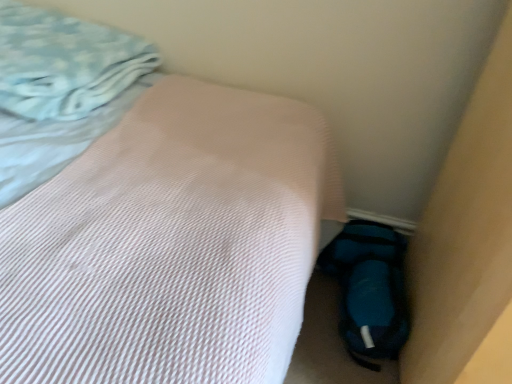
The width and height of the screenshot is (512, 384). I want to click on blue fuzzy sleeping bag at lower right, so click(x=370, y=289).

This screenshot has width=512, height=384. Describe the element at coordinates (370, 289) in the screenshot. I see `blue fuzzy sleeping bag at lower right` at that location.

This screenshot has height=384, width=512. I want to click on pink textured bed at center, so click(148, 213).

Based on the photo, is blue fuzzy sleeping bag at lower right beside pink textured bed at center?

No, blue fuzzy sleeping bag at lower right is not in contact with pink textured bed at center.

From a real-world perspective, between blue fuzzy sleeping bag at lower right and pink textured bed at center, who is vertically higher?

pink textured bed at center, from a real-world perspective.

From the image's perspective, which is above, blue fuzzy sleeping bag at lower right or pink textured bed at center?

pink textured bed at center is shown above in the image.

How much distance is there between blue fuzzy sleeping bag at lower right and pink textured bed at center?

62.62 centimeters.

Between light blue textured blanket at upper left and blue fuzzy sleeping bag at lower right, which one has larger size?

light blue textured blanket at upper left.

Is light blue textured blanket at upper left aimed at blue fuzzy sleeping bag at lower right?

No, light blue textured blanket at upper left is not oriented towards blue fuzzy sleeping bag at lower right.

This screenshot has width=512, height=384. I want to click on blanket in front of the blue fuzzy sleeping bag at lower right, so click(64, 63).

Can blue fuzzy sleeping bag at lower right be found inside light blue textured blanket at upper left?

No.

Is pink textured bed at center oriented away from light blue textured blanket at upper left?

Yes, light blue textured blanket at upper left is at the back of pink textured bed at center.

Find the location of `blanket behind the pink textured bed at center`. blanket behind the pink textured bed at center is located at coordinates (64, 63).

Measure the distance from pink textured bed at center to light blue textured blanket at upper left.

A distance of 20.23 centimeters exists between pink textured bed at center and light blue textured blanket at upper left.

Is point (89, 253) positioned after point (73, 93)?

That is False.

Does blue fuzzy sleeping bag at lower right come in front of light blue textured blanket at upper left?

No.

Based on the photo, from the image's perspective, which one is positioned higher, blue fuzzy sleeping bag at lower right or light blue textured blanket at upper left?

From the image's view, light blue textured blanket at upper left is above.

You are a GUI agent. You are given a task and a screenshot of the screen. Output one action in this format:
    pyautogui.click(x=<x>, y=<y>)
    Task: Click on the blanket in front of the blue fuzzy sleeping bag at lower right
    The height and width of the screenshot is (384, 512).
    Given the screenshot: What is the action you would take?
    pyautogui.click(x=64, y=63)

Is blue fuzzy sleeping bag at lower right oriented towards light blue textured blanket at upper left?

No, blue fuzzy sleeping bag at lower right is not turned towards light blue textured blanket at upper left.

Is point (44, 92) farther from camera compared to point (230, 131)?

That is False.

Is light blue textured blanket at upper left positioned with its back to pink textured bed at center?

Correct, light blue textured blanket at upper left is looking away from pink textured bed at center.

Considering their positions, is light blue textured blanket at upper left located in front of or behind pink textured bed at center?

Clearly, light blue textured blanket at upper left is behind pink textured bed at center.

Is light blue textured blanket at upper left positioned far away from pink textured bed at center?

No, light blue textured blanket at upper left is not far away from pink textured bed at center.

Based on their sizes in the image, would you say pink textured bed at center is bigger or smaller than blue fuzzy sleeping bag at lower right?

pink textured bed at center is bigger than blue fuzzy sleeping bag at lower right.

This screenshot has height=384, width=512. Identify the location of bed above the blue fuzzy sleeping bag at lower right (from a real-world perspective). (148, 213).

Considering the sizes of objects pink textured bed at center and blue fuzzy sleeping bag at lower right in the image provided, who is taller, pink textured bed at center or blue fuzzy sleeping bag at lower right?

With more height is pink textured bed at center.

Where is `bed above the blue fuzzy sleeping bag at lower right (from the image's perspective)`? bed above the blue fuzzy sleeping bag at lower right (from the image's perspective) is located at coordinates (148, 213).

I want to click on sleeping bag on the right of light blue textured blanket at upper left, so [x=370, y=289].

Which object lies further to the anchor point pink textured bed at center, blue fuzzy sleeping bag at lower right or light blue textured blanket at upper left?

blue fuzzy sleeping bag at lower right is further to pink textured bed at center.

Estimate the real-world distances between objects in this image. Which object is closer to blue fuzzy sleeping bag at lower right, light blue textured blanket at upper left or pink textured bed at center?

pink textured bed at center is positioned closer to the anchor blue fuzzy sleeping bag at lower right.

Based on their spatial positions, is pink textured bed at center or light blue textured blanket at upper left closer to blue fuzzy sleeping bag at lower right?

pink textured bed at center.

Based on their spatial positions, is blue fuzzy sleeping bag at lower right or pink textured bed at center further from light blue textured blanket at upper left?

Based on the image, blue fuzzy sleeping bag at lower right appears to be further to light blue textured blanket at upper left.

Estimate the real-world distances between objects in this image. Which object is further from light blue textured blanket at upper left, pink textured bed at center or blue fuzzy sleeping bag at lower right?

The object further to light blue textured blanket at upper left is blue fuzzy sleeping bag at lower right.

When comparing their distances from pink textured bed at center, does light blue textured blanket at upper left or blue fuzzy sleeping bag at lower right seem further?

The object further to pink textured bed at center is blue fuzzy sleeping bag at lower right.

Identify the location of bed between light blue textured blanket at upper left and blue fuzzy sleeping bag at lower right. Image resolution: width=512 pixels, height=384 pixels. (148, 213).